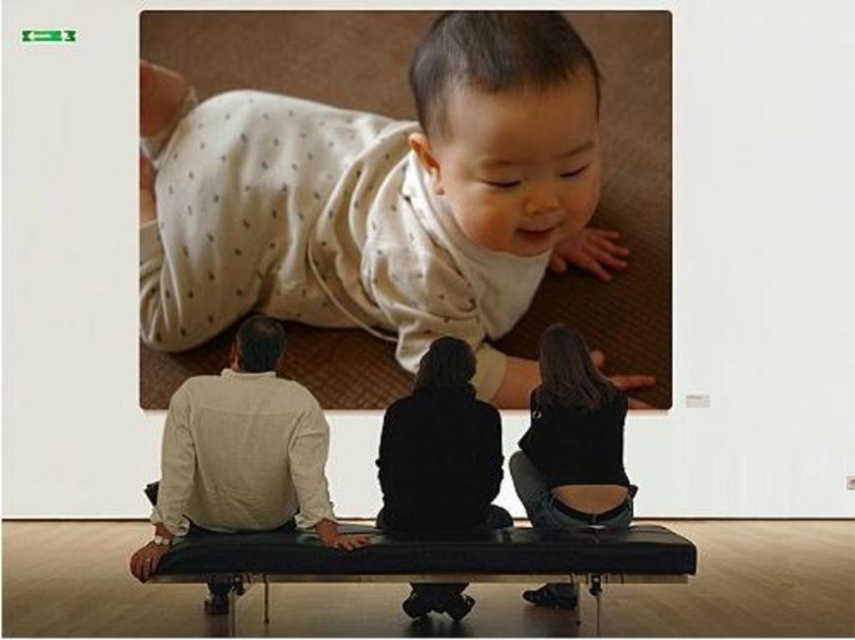
Question: From the image, what is the correct spatial relationship of black leather bench at center in relation to denim jeans at lower right?

Choices:
 (A) left
 (B) right

Answer: (A)

Question: Does light beige dotted fabric at upper center appear under denim jeans at lower right?

Choices:
 (A) no
 (B) yes

Answer: (A)

Question: Which point appears farthest from the camera in this image?

Choices:
 (A) (426, 144)
 (B) (475, 580)
 (C) (621, 484)

Answer: (A)

Question: Where is black leather bench at center located in relation to denim jeans at lower right in the image?

Choices:
 (A) below
 (B) above

Answer: (A)

Question: Which of the following is the closest to the observer?

Choices:
 (A) light beige dotted fabric at upper center
 (B) black leather bench at center

Answer: (B)

Question: Among these points, which one is farthest from the camera?

Choices:
 (A) tap(476, 556)
 (B) tap(531, 522)
 (C) tap(292, 209)

Answer: (C)